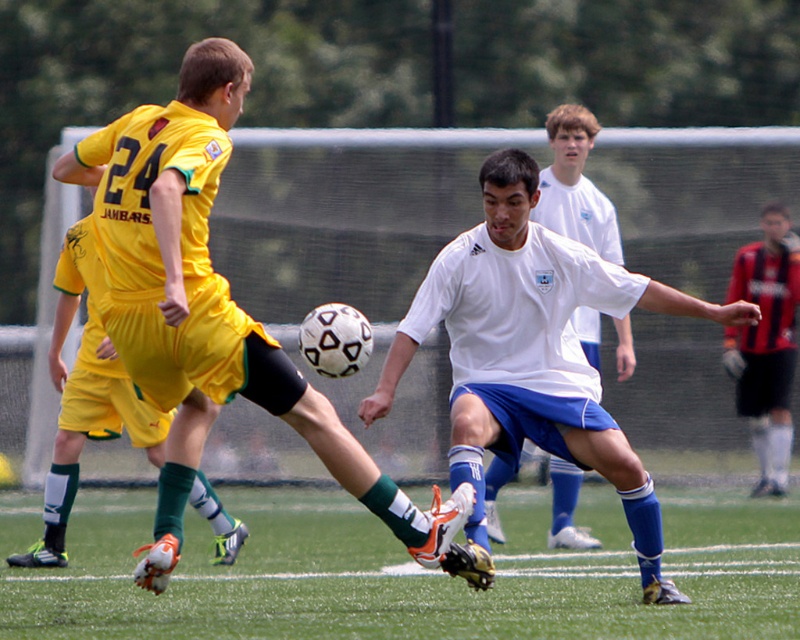
Question: Is white matte soccer ball at center positioned before matte yellow shorts at left?

Choices:
 (A) no
 (B) yes

Answer: (A)

Question: Which point is farther to the camera?

Choices:
 (A) green grass at lower center
 (B) white matte soccer ball at center
 (C) matte yellow shorts at center
 (D) matte yellow shorts at left

Answer: (A)

Question: Among these points, which one is farthest from the camera?

Choices:
 (A) tap(570, 365)
 (B) tap(554, 198)
 (C) tap(756, 496)
 (D) tap(128, 186)

Answer: (C)

Question: From the image, what is the correct spatial relationship of matte yellow shorts at left in relation to red jersey at right?

Choices:
 (A) left
 (B) right

Answer: (A)

Question: Does green grass at lower center appear under red jersey at right?

Choices:
 (A) yes
 (B) no

Answer: (A)

Question: Which point appears farthest from the camera in this image?

Choices:
 (A) (770, 291)
 (B) (554, 353)
 (C) (69, 388)
 (D) (172, 355)

Answer: (A)